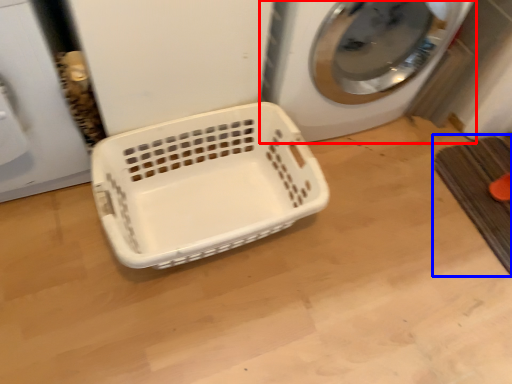
Question: Which object appears farthest to the camera in this image, washing machine (highlighted by a red box) or bath mat (highlighted by a blue box)?

Choices:
 (A) washing machine
 (B) bath mat

Answer: (B)